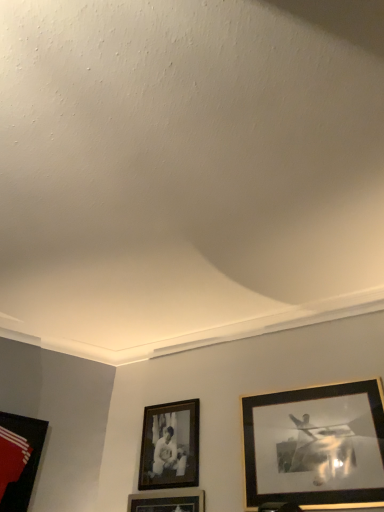
Question: In the image, is black matte picture frame at center, the 2th picture frame when ordered from left to right, on the left side or the right side of matte black picture frame at lower left, the 3th picture frame from the right?

Choices:
 (A) right
 (B) left

Answer: (A)

Question: In terms of width, does black matte picture frame at center, the second picture frame in the right-to-left sequence, look wider or thinner when compared to matte black picture frame at lower left, the 3th picture frame from the right?

Choices:
 (A) thin
 (B) wide

Answer: (A)

Question: Which is farther from the gold-framed picture at right, which is the 3th picture frame in left-to-right order?

Choices:
 (A) matte black picture frame at lower left, positioned as the 1th picture frame in left-to-right order
 (B) black matte picture frame at center, the second picture frame in the right-to-left sequence

Answer: (A)

Question: Estimate the real-world distances between objects in this image. Which object is closer to the black matte picture frame at center, the 2th picture frame when ordered from left to right?

Choices:
 (A) gold-framed picture at right, the first picture frame when ordered from right to left
 (B) matte black picture frame at lower left, the 3th picture frame from the right

Answer: (A)